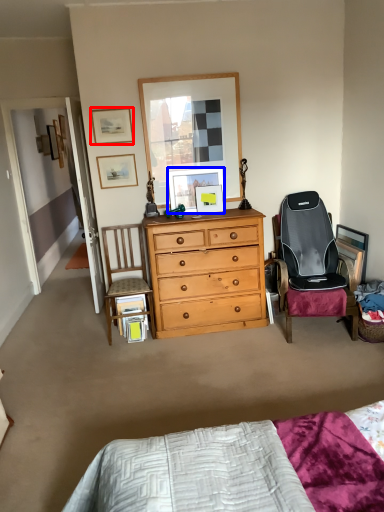
Question: Among these objects, which one is nearest to the camera, picture frame (highlighted by a red box) or picture frame (highlighted by a blue box)?

Choices:
 (A) picture frame
 (B) picture frame

Answer: (A)